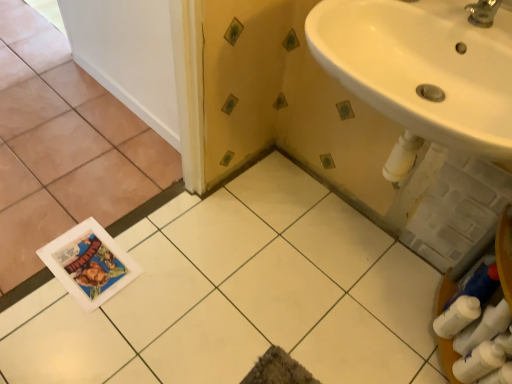
Question: Does white glossy tile at center, arranged as the 2th ceramic tile when viewed from the left, touch white smooth door at upper left?

Choices:
 (A) yes
 (B) no

Answer: (B)

Question: Does white glossy tile at center, marked as the 1th ceramic tile in a right-to-left arrangement, contain white smooth door at upper left?

Choices:
 (A) no
 (B) yes

Answer: (A)

Question: Is white glossy tile at center, arranged as the 2th ceramic tile when viewed from the left, at the right side of white smooth door at upper left?

Choices:
 (A) no
 (B) yes

Answer: (B)

Question: Is the position of white glossy tile at center, arranged as the 2th ceramic tile when viewed from the left, more distant than that of white smooth door at upper left?

Choices:
 (A) yes
 (B) no

Answer: (B)

Question: Can you confirm if white glossy tile at center, arranged as the 2th ceramic tile when viewed from the left, is smaller than white smooth door at upper left?

Choices:
 (A) yes
 (B) no

Answer: (B)

Question: From a real-world perspective, is white glossy tile at center, marked as the 1th ceramic tile in a right-to-left arrangement, positioned under white smooth door at upper left based on gravity?

Choices:
 (A) yes
 (B) no

Answer: (A)

Question: Considering the relative positions of white glossy tile at lower left, which is the second ceramic tile in right-to-left order, and white glossy tile at center, marked as the 1th ceramic tile in a right-to-left arrangement, in the image provided, is white glossy tile at lower left, which is the second ceramic tile in right-to-left order, in front of white glossy tile at center, marked as the 1th ceramic tile in a right-to-left arrangement,?

Choices:
 (A) no
 (B) yes

Answer: (A)

Question: Does white glossy tile at lower left, which is the second ceramic tile in right-to-left order, have a lesser height compared to white glossy tile at center, arranged as the 2th ceramic tile when viewed from the left?

Choices:
 (A) yes
 (B) no

Answer: (B)

Question: Is white glossy tile at lower left, which is the second ceramic tile in right-to-left order, positioned with its back to white glossy tile at center, marked as the 1th ceramic tile in a right-to-left arrangement?

Choices:
 (A) yes
 (B) no

Answer: (B)

Question: Considering the relative positions of white glossy tile at lower left, which appears as the 1th ceramic tile when viewed from the left, and white glossy tile at center, marked as the 1th ceramic tile in a right-to-left arrangement, in the image provided, is white glossy tile at lower left, which appears as the 1th ceramic tile when viewed from the left, to the left of white glossy tile at center, marked as the 1th ceramic tile in a right-to-left arrangement, from the viewer's perspective?

Choices:
 (A) yes
 (B) no

Answer: (A)

Question: From a real-world perspective, is white glossy tile at lower left, which appears as the 1th ceramic tile when viewed from the left, physically above white glossy tile at center, marked as the 1th ceramic tile in a right-to-left arrangement?

Choices:
 (A) yes
 (B) no

Answer: (A)

Question: From the image's perspective, is white glossy tile at lower left, which appears as the 1th ceramic tile when viewed from the left, on top of white glossy tile at center, arranged as the 2th ceramic tile when viewed from the left?

Choices:
 (A) no
 (B) yes

Answer: (B)

Question: Is white smooth door at upper left smaller than white glossy tile at lower left, which is the second ceramic tile in right-to-left order?

Choices:
 (A) no
 (B) yes

Answer: (B)